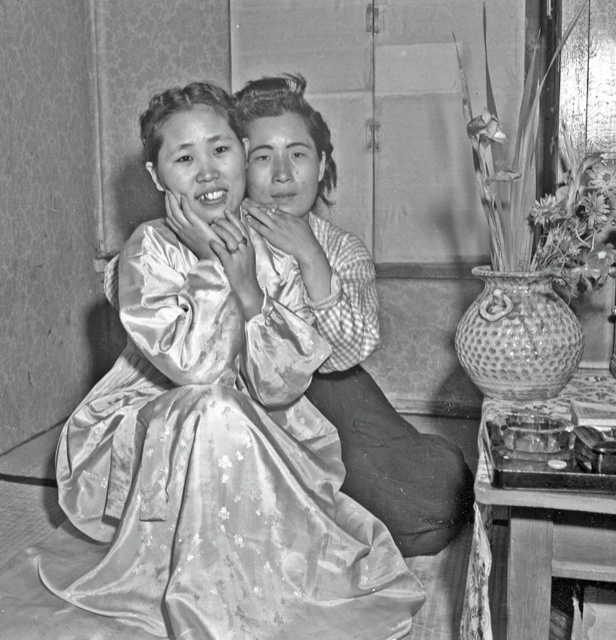
Between silky satin dress at center and silky satin kimono at center, which one appears on the right side from the viewer's perspective?

Positioned to the right is silky satin kimono at center.

Between point (241, 611) and point (243, 100), which one is positioned behind?

Point (243, 100)

At what (x,y) coordinates should I click in order to perform the action: click on silky satin dress at center. Please return your answer as a coordinate pair (x, y). The width and height of the screenshot is (616, 640). Looking at the image, I should click on (219, 468).

Where is `silky satin dress at center`? silky satin dress at center is located at coordinates (219, 468).